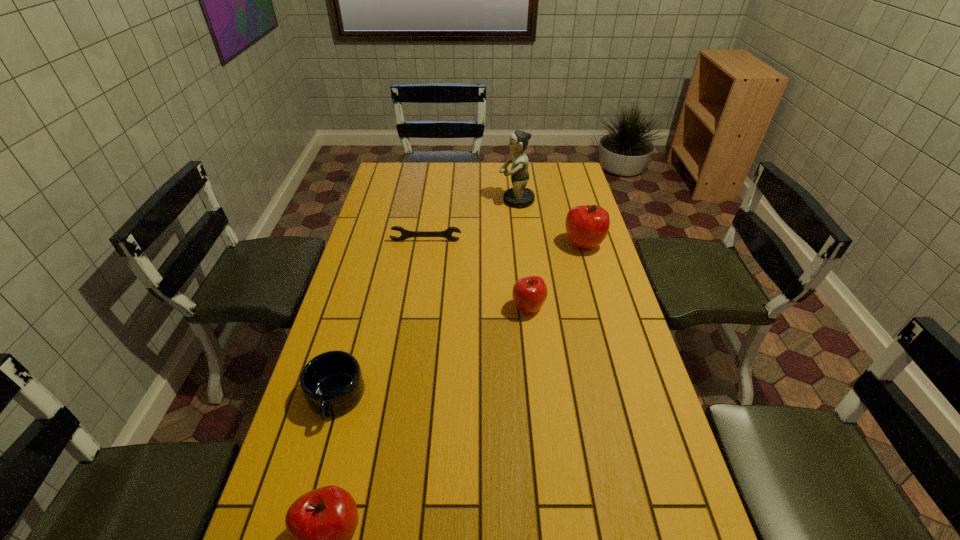
What are the coordinates of `vacant area at the left edge of the desktop` in the screenshot? It's located at [x=373, y=253].

In order to click on free location at the right edge in this screenshot , I will do `click(580, 309)`.

The height and width of the screenshot is (540, 960). In order to click on free location at the far right corner of the desktop in this screenshot , I will do `click(564, 165)`.

Find the location of a particular element. The width and height of the screenshot is (960, 540). vacant point located between the fifth farthest object and the figurine is located at coordinates (426, 299).

At what (x,y) coordinates should I click in order to perform the action: click on empty space that is in between the wrench and the second nearest object. Please return your answer as a coordinate pair (x, y). The width and height of the screenshot is (960, 540). Looking at the image, I should click on (381, 320).

This screenshot has width=960, height=540. I want to click on vacant region between the shortest object and the mug, so pyautogui.click(x=381, y=320).

At what (x,y) coordinates should I click in order to perform the action: click on empty location between the shortest object and the rightmost object. Please return your answer as a coordinate pair (x, y). The height and width of the screenshot is (540, 960). Looking at the image, I should click on (505, 243).

Where is `vacant region between the shortest apple and the fifth farthest object`? vacant region between the shortest apple and the fifth farthest object is located at coordinates (432, 353).

The image size is (960, 540). In order to click on vacant area that lies between the wrench and the shortest apple in this screenshot , I will do `click(477, 274)`.

Where is `vacant point located between the fifth farthest object and the figurine`? vacant point located between the fifth farthest object and the figurine is located at coordinates click(426, 299).